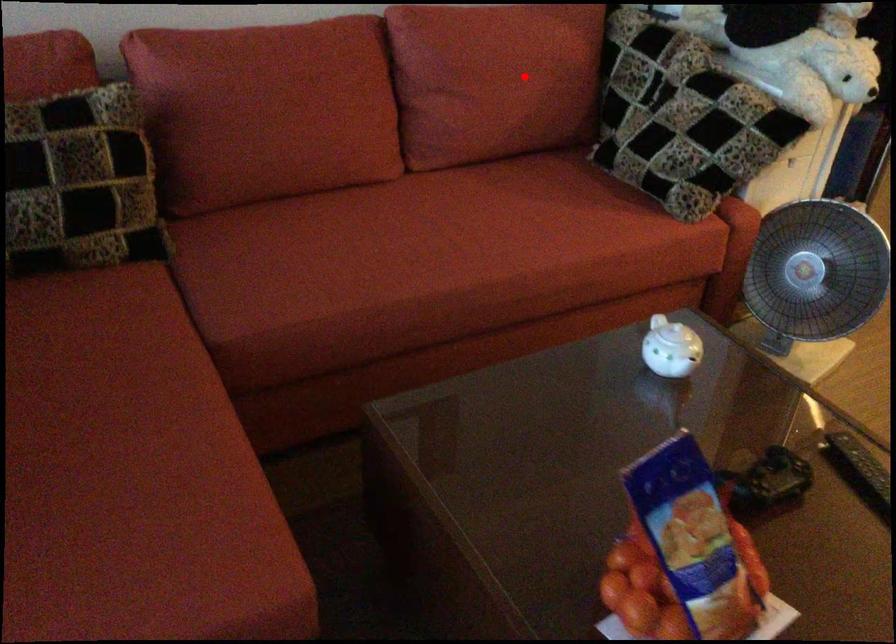
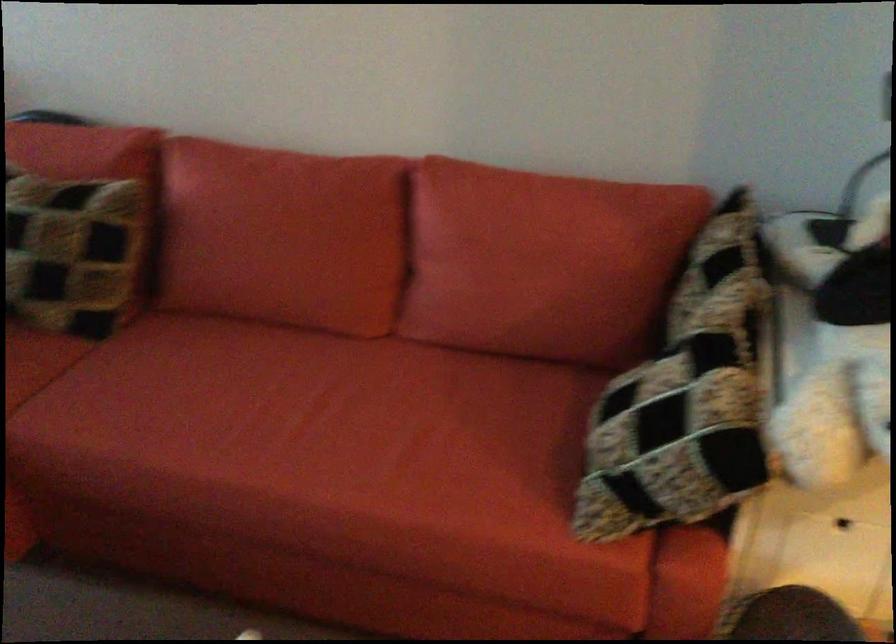
Find the pixel in the second image that matches the highlighted location in the first image.

(538, 270)